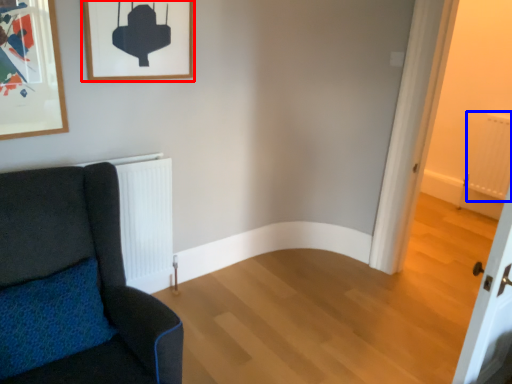
Question: Which object is closer to the camera taking this photo, picture frame (highlighted by a red box) or radiator (highlighted by a blue box)?

Choices:
 (A) picture frame
 (B) radiator

Answer: (A)